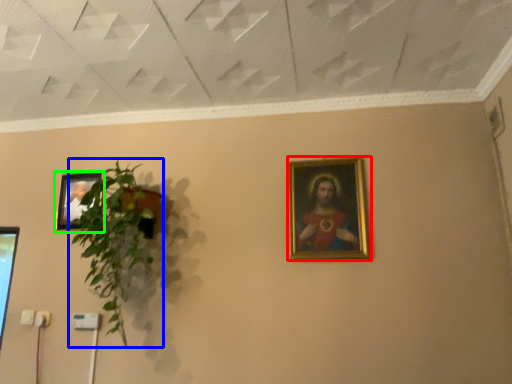
Question: Which is nearer to the picture frame (highlighted by a red box)? houseplant (highlighted by a blue box) or picture frame (highlighted by a green box).

Choices:
 (A) houseplant
 (B) picture frame

Answer: (A)